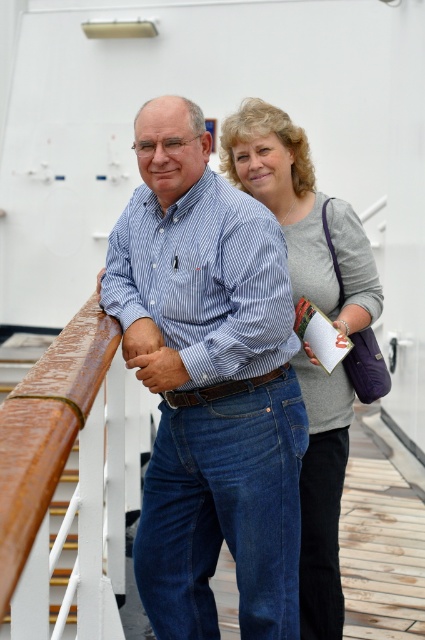
Question: Which point is closer to the camera taking this photo?

Choices:
 (A) tap(17, 436)
 (B) tap(280, 344)

Answer: (A)

Question: Which of the following is the farthest from the observer?

Choices:
 (A) (161, 248)
 (B) (323, 616)
 (C) (19, 550)

Answer: (B)

Question: Is gray matte sweater at center behind rusty wood handrail at left?

Choices:
 (A) yes
 (B) no

Answer: (A)

Question: Is blue striped shirt at center to the right of rusty wood handrail at left from the viewer's perspective?

Choices:
 (A) no
 (B) yes

Answer: (B)

Question: From the image, what is the correct spatial relationship of gray matte sweater at center in relation to rusty wood handrail at left?

Choices:
 (A) below
 (B) above

Answer: (B)

Question: Which point appears closest to the camera in this image?

Choices:
 (A) (302, 492)
 (B) (65, 364)

Answer: (B)